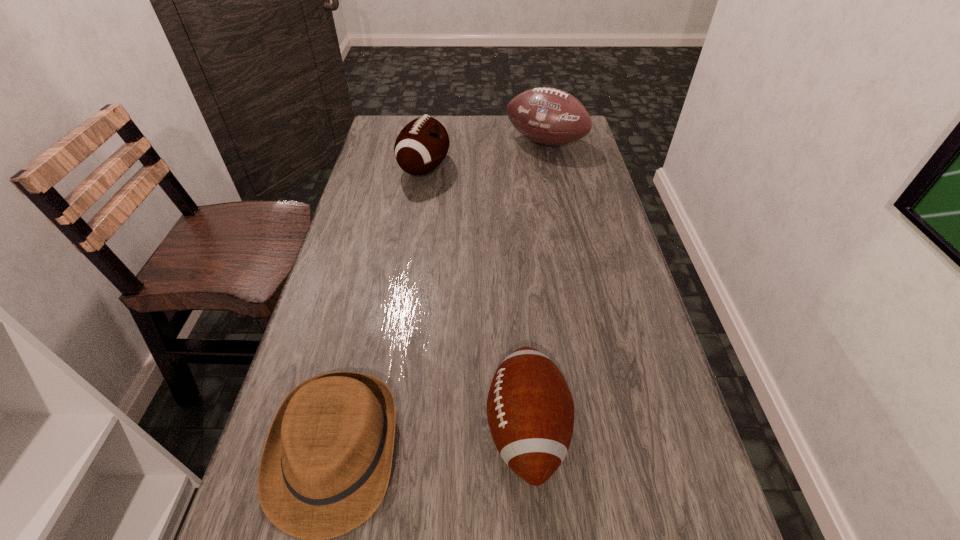
At what (x,y) coordinates should I click in order to perform the action: click on the leftmost football. Please return your answer as a coordinate pair (x, y). Looking at the image, I should click on (421, 146).

This screenshot has height=540, width=960. I want to click on the nearest football, so click(x=530, y=410).

Where is `vacant space positioned 0.190m on the right of the leftmost football`? The image size is (960, 540). vacant space positioned 0.190m on the right of the leftmost football is located at coordinates (511, 168).

Identify the location of vacant space situated 0.160m on the laces of the nearest football. This screenshot has height=540, width=960. (397, 429).

Locate an element on the screen. The image size is (960, 540). blank area located 0.060m on the laces of the nearest football is located at coordinates (453, 429).

At what (x,y) coordinates should I click in order to perform the action: click on free space located 0.340m on the laces of the nearest football. Please return your answer as a coordinate pair (x, y). This screenshot has height=540, width=960. Looking at the image, I should click on (298, 429).

The width and height of the screenshot is (960, 540). In order to click on object that is at the left edge in this screenshot , I will do `click(421, 146)`.

At what (x,y) coordinates should I click in order to perform the action: click on object that is at the right edge. Please return your answer as a coordinate pair (x, y). Looking at the image, I should click on (552, 117).

Find the location of a particular element. The image size is (960, 540). object that is at the far left corner is located at coordinates (421, 146).

I want to click on object present at the far right corner, so click(x=552, y=117).